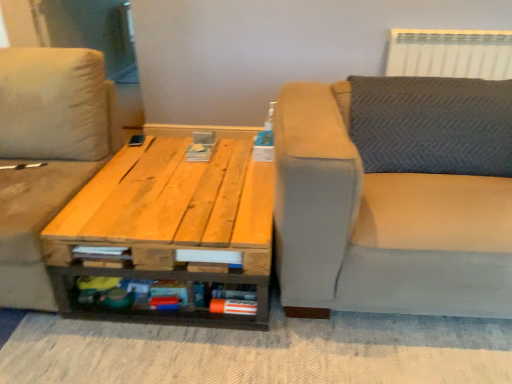
Question: Does natural wood table at center have a lesser width compared to white plastic radiator at upper right?

Choices:
 (A) no
 (B) yes

Answer: (A)

Question: Can you confirm if natural wood table at center is smaller than white plastic radiator at upper right?

Choices:
 (A) no
 (B) yes

Answer: (A)

Question: Can white plastic radiator at upper right be found inside natural wood table at center?

Choices:
 (A) yes
 (B) no

Answer: (B)

Question: From the image's perspective, is natural wood table at center under white plastic radiator at upper right?

Choices:
 (A) no
 (B) yes

Answer: (B)

Question: Is natural wood table at center looking in the opposite direction of white plastic radiator at upper right?

Choices:
 (A) yes
 (B) no

Answer: (B)

Question: Does natural wood table at center have a lesser height compared to white plastic radiator at upper right?

Choices:
 (A) no
 (B) yes

Answer: (A)

Question: Is natural wood table at center wider than beige fabric studio couch at left, the 1th studio couch when ordered from left to right?

Choices:
 (A) yes
 (B) no

Answer: (A)

Question: From a real-world perspective, is natural wood table at center on beige fabric studio couch at left, placed as the 2th studio couch when sorted from right to left?

Choices:
 (A) no
 (B) yes

Answer: (A)

Question: Is natural wood table at center shorter than beige fabric studio couch at left, placed as the 2th studio couch when sorted from right to left?

Choices:
 (A) no
 (B) yes

Answer: (B)

Question: From the image's perspective, would you say natural wood table at center is positioned over beige fabric studio couch at left, placed as the 2th studio couch when sorted from right to left?

Choices:
 (A) no
 (B) yes

Answer: (A)

Question: Considering the relative sizes of natural wood table at center and beige fabric studio couch at left, the 1th studio couch when ordered from left to right, in the image provided, is natural wood table at center thinner than beige fabric studio couch at left, the 1th studio couch when ordered from left to right,?

Choices:
 (A) yes
 (B) no

Answer: (B)

Question: Is natural wood table at center next to beige fabric studio couch at left, placed as the 2th studio couch when sorted from right to left, and touching it?

Choices:
 (A) no
 (B) yes

Answer: (A)

Question: Can you see beige fabric studio couch at left, the 1th studio couch when ordered from left to right, touching light gray fabric couch at right, arranged as the second studio couch when viewed from the left?

Choices:
 (A) no
 (B) yes

Answer: (A)